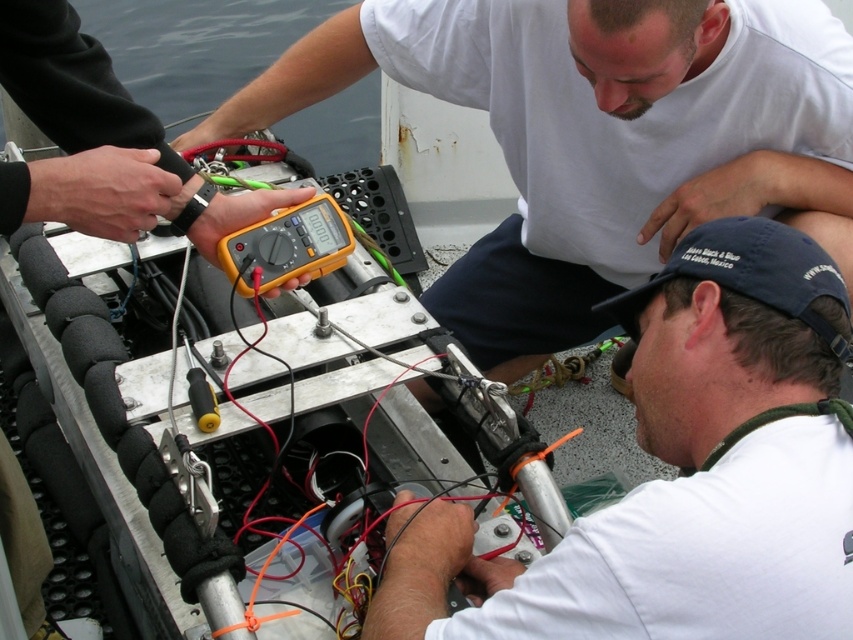
Question: Does yellow plastic multimeter at center appear under white matte cap at lower right?

Choices:
 (A) no
 (B) yes

Answer: (A)

Question: Which point appears closest to the camera in this image?

Choices:
 (A) (769, 144)
 (B) (755, 252)

Answer: (B)

Question: Which object is closer to the camera taking this photo?

Choices:
 (A) white matte cap at lower right
 (B) yellow plastic multimeter at center

Answer: (A)

Question: Where is yellow plastic multimeter at center located in relation to white matte cap at lower right in the image?

Choices:
 (A) above
 (B) below

Answer: (A)

Question: Is yellow plastic multimeter at center in front of white matte cap at lower right?

Choices:
 (A) yes
 (B) no

Answer: (B)